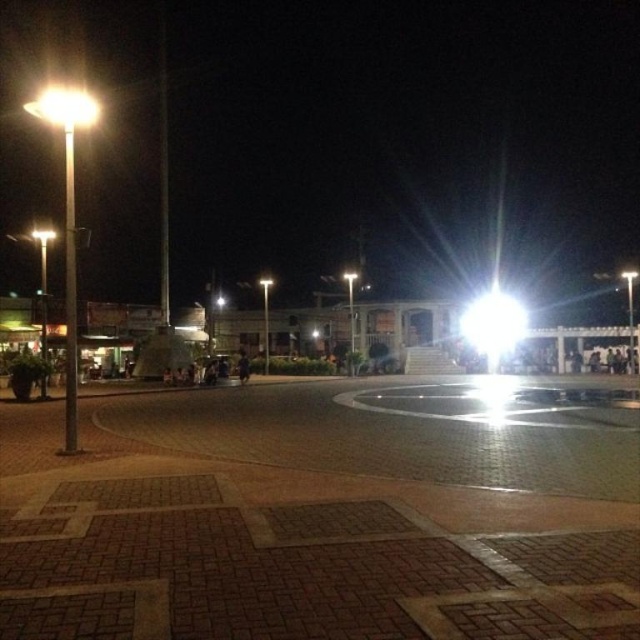
In the scene shown: You are standing in the plaza and want to find the brightest light source to guide you to the main building. Which light should you head towards, the bright white light at center or the matte white streetlight at upper left?

The bright white light at center is smaller than the matte white streetlight at upper left, but brightness isn

You are standing in the nighttime plaza and want to find the bright white light at center. According to the coordinates provided, where should you look relative to the classical building with columns?

The bright white light at center is located at coordinates point (492, 323), which places it near the classical building with columns since it is positioned at the center of the plaza.